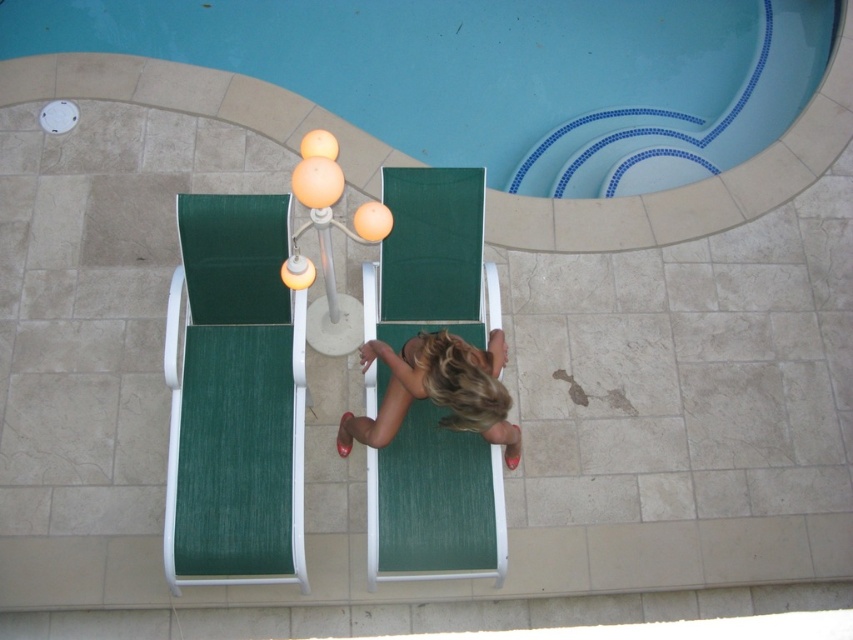
Which is behind, point (277, 358) or point (408, 410)?

Positioned behind is point (277, 358).

Which is above, green fabric beach chair at left or green fabric beach chair at center?

Positioned higher is green fabric beach chair at left.

Which is in front, point (299, 467) or point (405, 339)?

Point (299, 467) is in front.

At what (x,y) coordinates should I click in order to perform the action: click on green fabric beach chair at left. Please return your answer as a coordinate pair (x, y). The image size is (853, 640). Looking at the image, I should click on (234, 396).

Who is more forward, (374,333) or (468,349)?

Point (468,349) is in front.

Between green fabric beach chair at center and blonde hair at center, which one appears on the right side from the viewer's perspective?

Positioned to the right is blonde hair at center.

Between point (366, 508) and point (398, 394), which one is positioned behind?

Point (366, 508)

The height and width of the screenshot is (640, 853). I want to click on green fabric beach chair at center, so click(434, 502).

How distant is blue tile swimming pool at upper center from green fabric beach chair at left?

The distance of blue tile swimming pool at upper center from green fabric beach chair at left is 9.39 feet.

In the scene shown: Can you confirm if blue tile swimming pool at upper center is positioned to the right of green fabric beach chair at left?

Indeed, blue tile swimming pool at upper center is positioned on the right side of green fabric beach chair at left.

Which is in front, point (496, 125) or point (212, 358)?

Positioned in front is point (212, 358).

The image size is (853, 640). Identify the location of blue tile swimming pool at upper center. [492, 72].